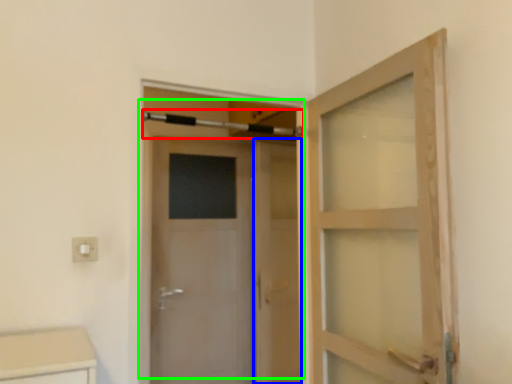
Question: Which is nearer to the towel bar (highlighted by a red box)? screen door (highlighted by a blue box) or door (highlighted by a green box).

Choices:
 (A) screen door
 (B) door

Answer: (B)